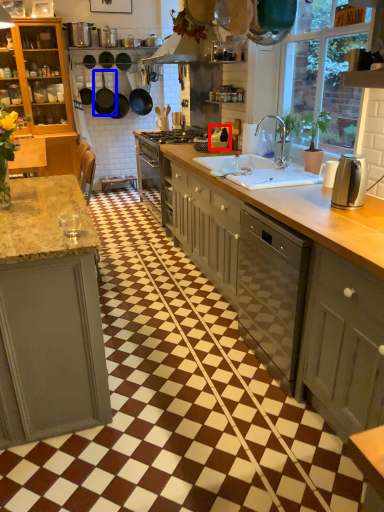
Question: Which of the following is the closest to the observer, appliance (highlighted by a red box) or frying pan (highlighted by a blue box)?

Choices:
 (A) appliance
 (B) frying pan

Answer: (A)